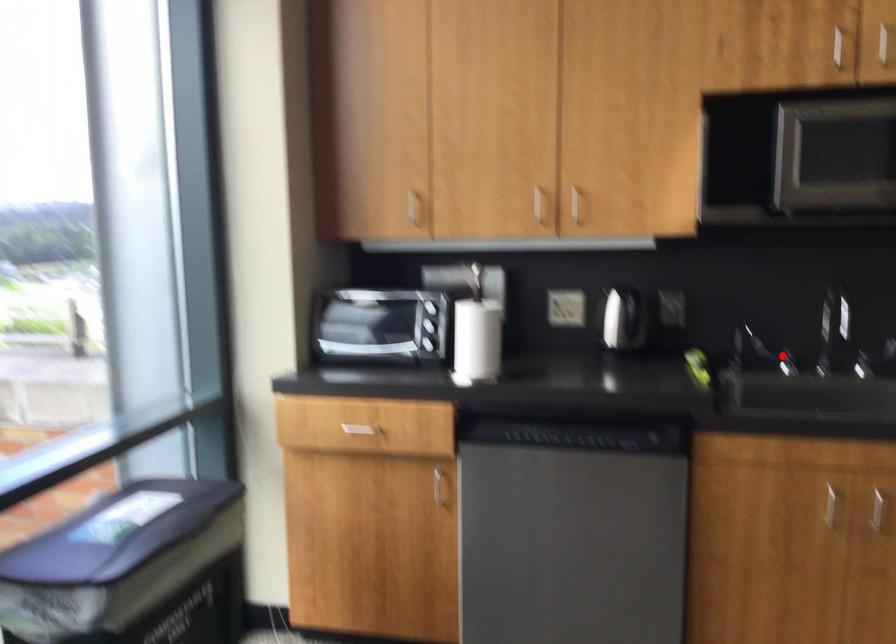
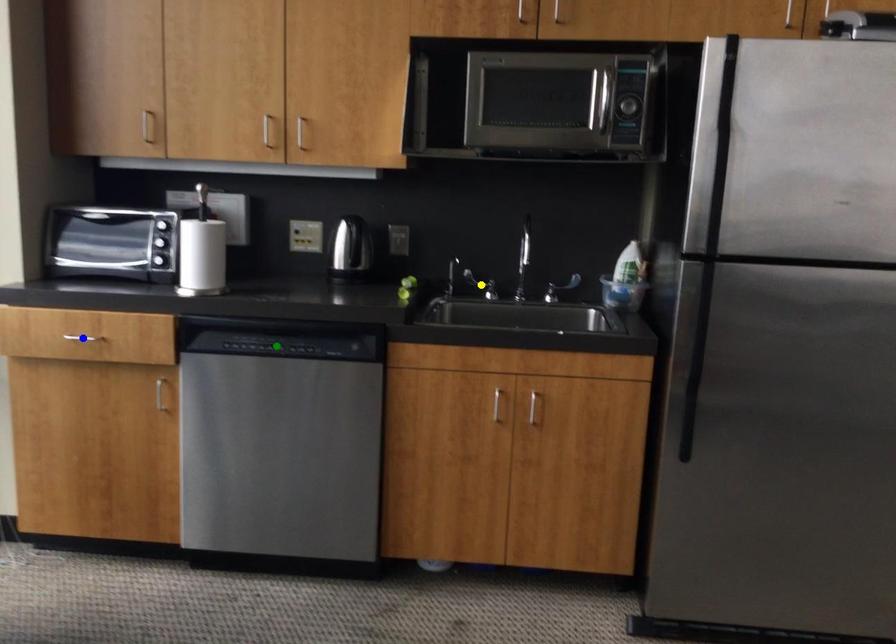
Question: I am providing you with two images of the same scene from different viewpoints. A red point is marked on the first image. You are given multiple points on the second image. Which mark in image 2 goes with the point in image 1?

Choices:
 (A) blue point
 (B) green point
 (C) yellow point

Answer: (C)